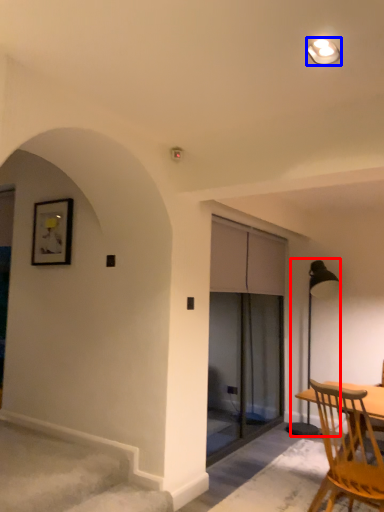
Question: Which object appears closest to the camera in this image, lamp (highlighted by a red box) or light fixture (highlighted by a blue box)?

Choices:
 (A) lamp
 (B) light fixture

Answer: (B)